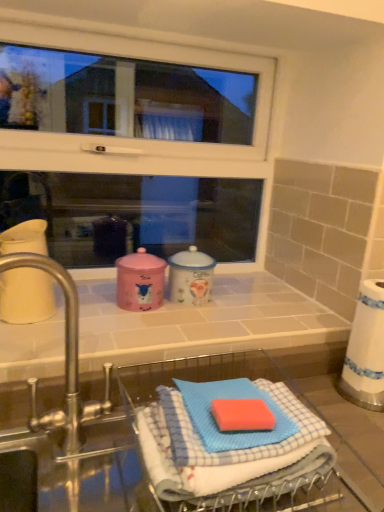
Identify the location of free space above white glossy counter top at center (from a real-world perspective). This screenshot has width=384, height=512. (200, 303).